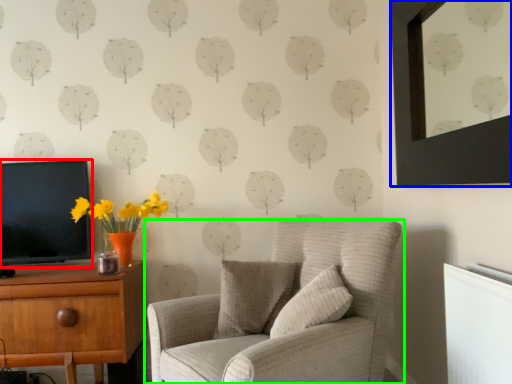
Question: Which object is positioned farthest from television (highlighted by a red box)? Select from picture frame (highlighted by a blue box) and chair (highlighted by a green box).

Choices:
 (A) picture frame
 (B) chair

Answer: (A)